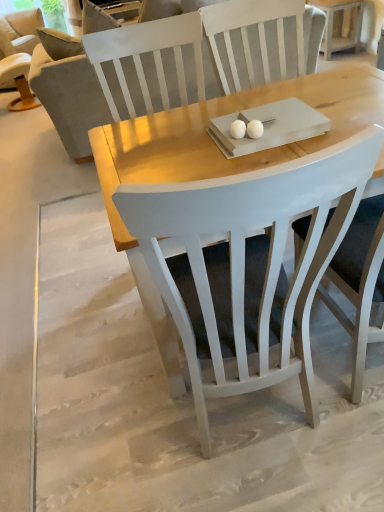
This screenshot has width=384, height=512. In order to click on free space to the left of white wood chair at center, marked as the second chair in a left-to-right arrangement in this screenshot , I will do `click(115, 413)`.